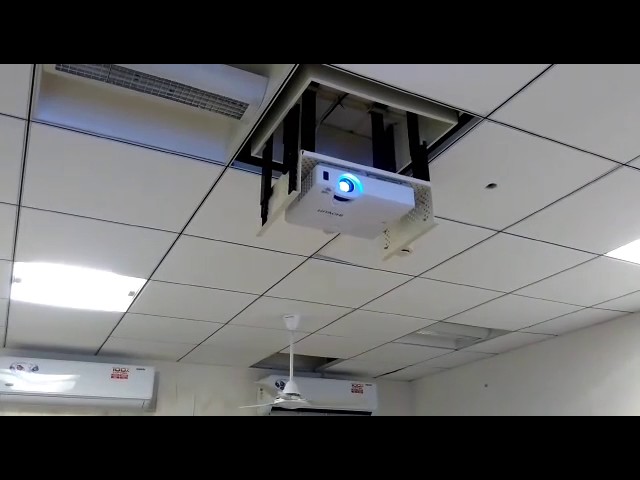
I want to click on ceiling lights, so click(98, 287), click(443, 329).